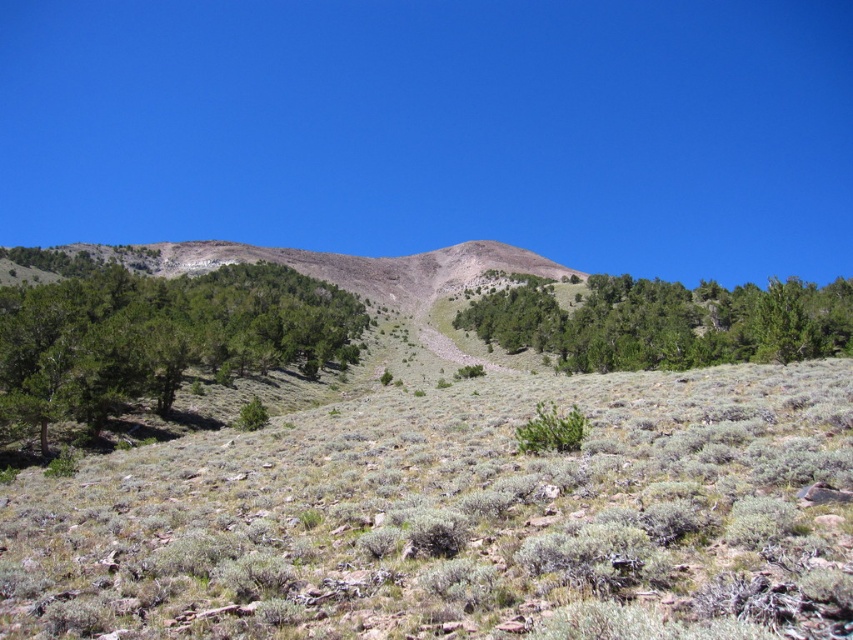
Between point (102, 321) and point (619, 284), which one is positioned behind?

Point (619, 284)

How far apart are green leafy tree at center-left and green leafy trees at center?

56.88 meters

Does point (234, 266) lie behind point (708, 301)?

Yes, point (234, 266) is behind point (708, 301).

Image resolution: width=853 pixels, height=640 pixels. In order to click on green leafy tree at center-left in this screenshot , I will do `click(157, 339)`.